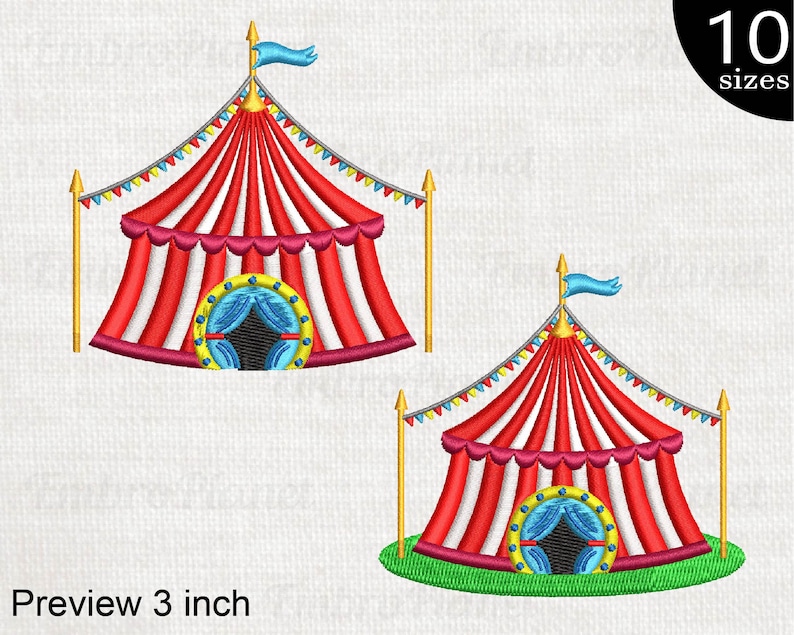
Where is `pennant banner with red, blue, yellow pennants`? pennant banner with red, blue, yellow pennants is located at coordinates (156, 161), (326, 148), (479, 378), (637, 378).